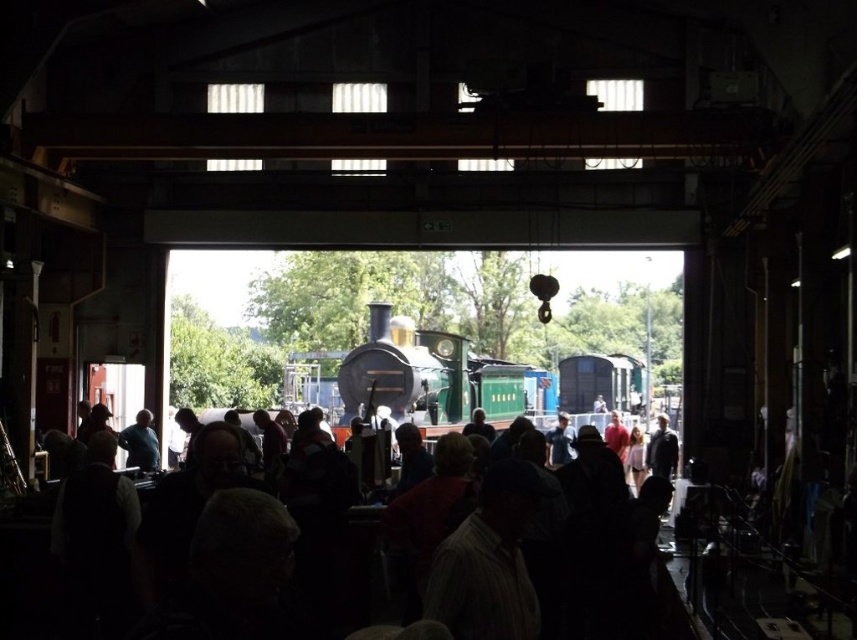
Is dark fabric crowd at center thinner than polished black locomotive at center?

Yes.

Does dark fabric crowd at center lie in front of polished black locomotive at center?

Yes, dark fabric crowd at center is in front of polished black locomotive at center.

Between point (645, 481) and point (357, 410), which one is positioned behind?

The point (357, 410) is behind.

Find the location of `dark fabric crowd at center`. dark fabric crowd at center is located at coordinates (550, 563).

Can you confirm if dark fabric crowd at center is smaller than matte blue shirt at left?

No, dark fabric crowd at center is not smaller than matte blue shirt at left.

Is dark fabric crowd at center to the right of matte blue shirt at left from the viewer's perspective?

Indeed, dark fabric crowd at center is positioned on the right side of matte blue shirt at left.

Does point (651, 492) come behind point (130, 424)?

No, it is not.

Identify the location of dark fabric crowd at center. (550, 563).

Does polished black locomotive at center appear on the right side of matte blue shirt at left?

Yes, polished black locomotive at center is to the right of matte blue shirt at left.

Is point (499, 374) less distant than point (132, 433)?

No, it is behind (132, 433).

Which is behind, point (436, 429) or point (147, 413)?

The point (436, 429) is behind.

Identify the location of polished black locomotive at center. The height and width of the screenshot is (640, 857). (417, 378).